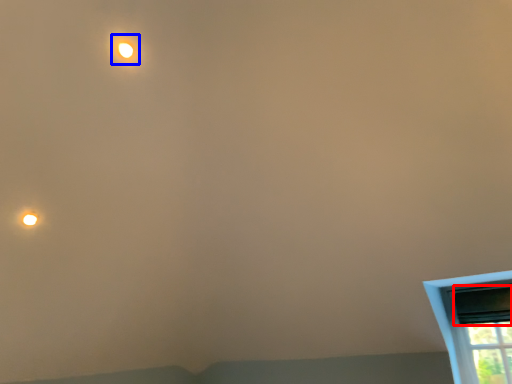
Question: Which point is further to the camera, window screen (highlighted by a red box) or light (highlighted by a blue box)?

Choices:
 (A) window screen
 (B) light

Answer: (A)